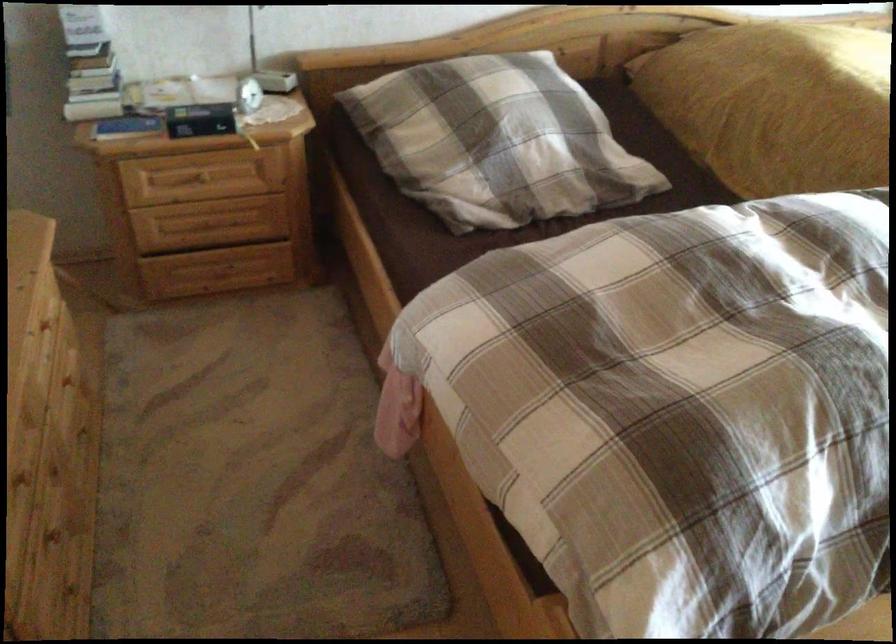
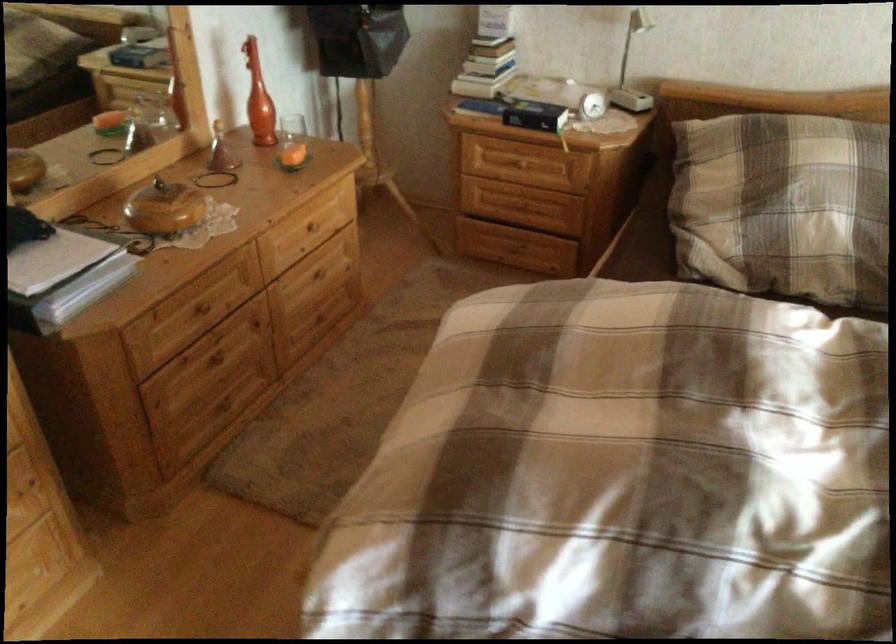
Find the pixel in the second image that matches the point at 102,116 in the first image.

(474, 86)